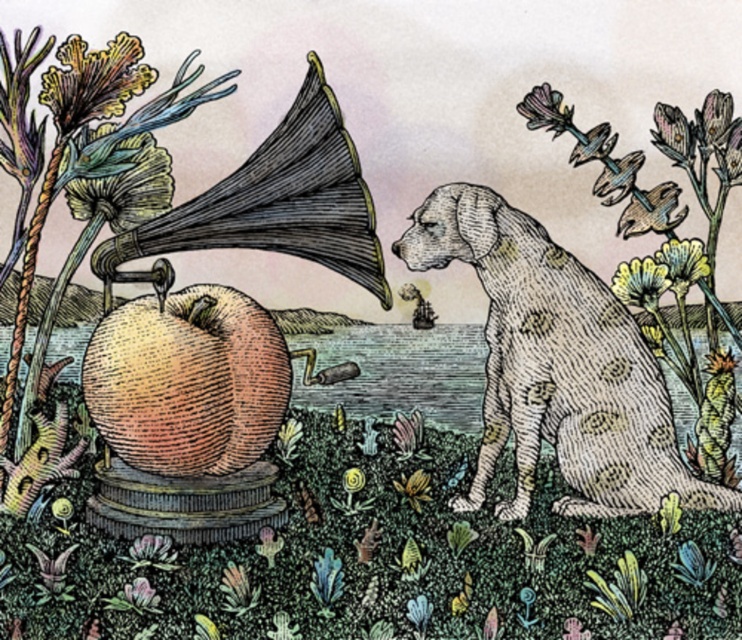
Question: Which is nearer to the speckled fur dog at right?

Choices:
 (A) matte purple flower at upper right
 (B) pastel yellow petals at upper right
 (C) yellow textured petals at upper right
 (D) matte yellow flower at upper right

Answer: (C)

Question: Does yellow textured petals at upper right have a lesser width compared to matte purple flower at upper right?

Choices:
 (A) yes
 (B) no

Answer: (A)

Question: Does speckled fur dog at right appear on the right side of matte yellow-green leaf at upper left?

Choices:
 (A) yes
 (B) no

Answer: (A)

Question: Among these objects, which one is farthest from the camera?

Choices:
 (A) speckled fur dog at right
 (B) matte yellow flower at upper right

Answer: (B)

Question: Among these objects, which one is nearest to the camera?

Choices:
 (A) matte purple flower at upper right
 (B) speckled fur dog at right
 (C) matte yellow flower at upper right
 (D) pastel yellow petals at upper right

Answer: (B)

Question: Is matte yellow-green leaf at upper left to the right of matte purple flower at upper right from the viewer's perspective?

Choices:
 (A) no
 (B) yes

Answer: (A)